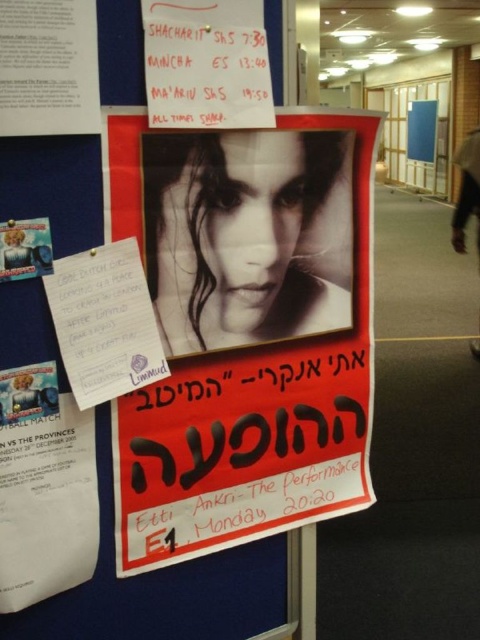
Question: Is matte paper poster at upper left thinner than black hair at upper center?

Choices:
 (A) no
 (B) yes

Answer: (B)

Question: Can you confirm if matte paper poster at center is positioned above smooth skin portrait at center?

Choices:
 (A) no
 (B) yes

Answer: (A)

Question: Which of the following is the farthest from the observer?

Choices:
 (A) smooth skin portrait at center
 (B) matte paper poster at upper center
 (C) matte paper poster at center
 (D) matte plastic cd at upper left

Answer: (A)

Question: Which object is positioned closest to the matte plastic cd at upper left?

Choices:
 (A) matte paper poster at upper left
 (B) matte paper poster at upper center

Answer: (A)

Question: Where is smooth skin portrait at center located in relation to matte paper poster at upper center in the image?

Choices:
 (A) above
 (B) below

Answer: (B)

Question: Which object appears farthest from the camera in this image?

Choices:
 (A) matte paper poster at upper center
 (B) matte plastic cd at upper left
 (C) black hair at upper center

Answer: (C)